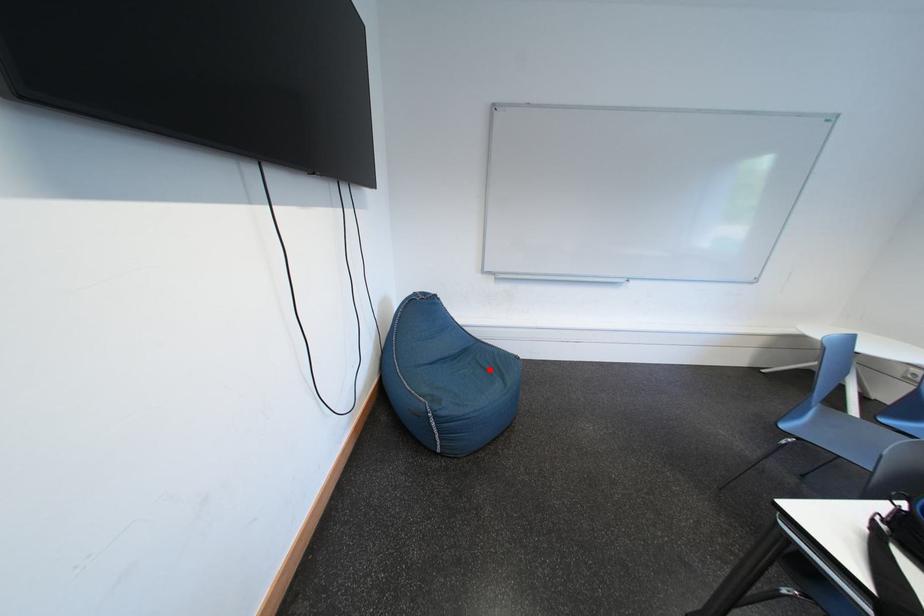
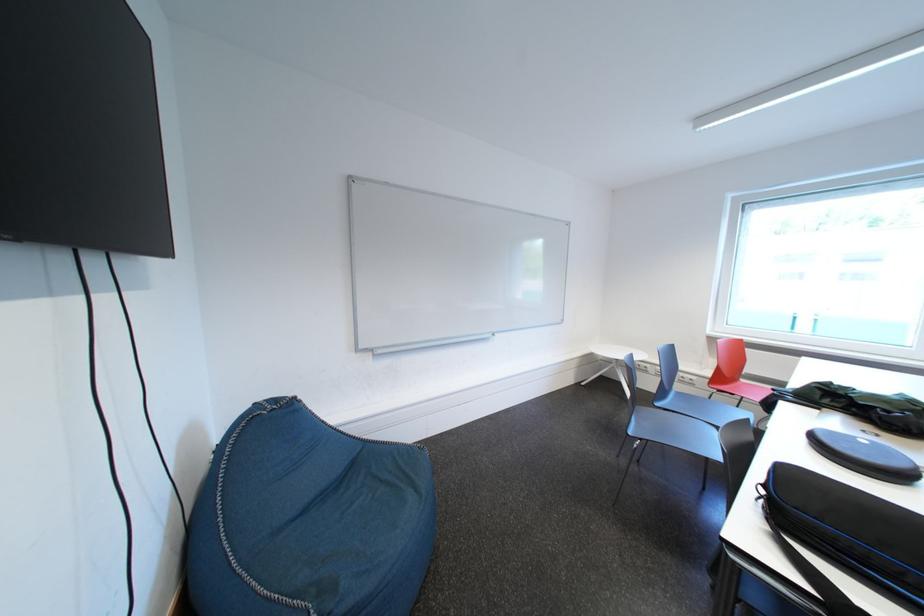
The point at the highlighted location is marked in the first image. Where is the corresponding point in the second image?

(390, 484)